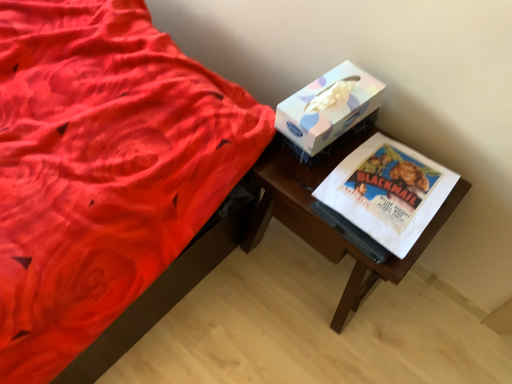
Identify the location of space that is in front of wooden table at right. The width and height of the screenshot is (512, 384). (309, 348).